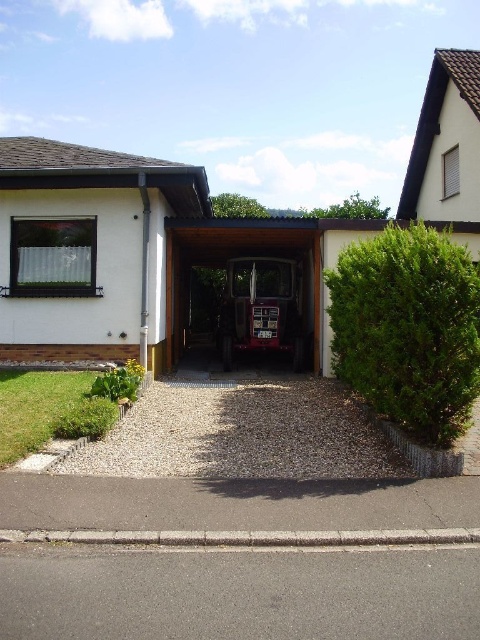
Does asphalt at lower center have a lesser height compared to metallic red car at center?

Yes, asphalt at lower center is shorter than metallic red car at center.

Is point (474, 566) in front of point (279, 305)?

Yes.

What do you see at coordinates (239, 593) in the screenshot? This screenshot has width=480, height=640. I see `asphalt at lower center` at bounding box center [239, 593].

This screenshot has height=640, width=480. Identify the location of asphalt at lower center. (239, 593).

Can you confirm if green leafy hedge at right is taller than metallic red tractor at center?

Yes, green leafy hedge at right is taller than metallic red tractor at center.

Can you confirm if green leafy hedge at right is positioned to the left of metallic red tractor at center?

Incorrect, green leafy hedge at right is not on the left side of metallic red tractor at center.

Is point (398, 308) more distant than point (290, 234)?

No.

You are a GUI agent. You are given a task and a screenshot of the screen. Output one action in this format:
    pyautogui.click(x=<x>, y=<y>)
    Task: Click on the green leafy hedge at right
    
    Given the screenshot: What is the action you would take?
    pyautogui.click(x=408, y=328)

Based on the photo, how distant is asphalt at lower center from metallic red tractor at center?

asphalt at lower center is 8.56 meters away from metallic red tractor at center.

Does point (133, 625) come behind point (207, 225)?

No, it is in front of (207, 225).

Does point (374, 605) come farther from viewer compared to point (275, 328)?

No, it is in front of (275, 328).

Identify the location of asphalt at lower center. Image resolution: width=480 pixels, height=640 pixels. (239, 593).